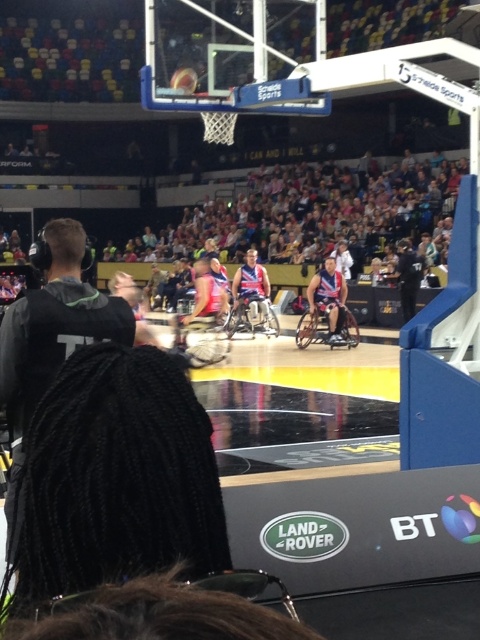
In the scene shown: You are a spectator at the game and want to take a photo of the shiny metallic basketball at center without including the black hoodie at left in the frame. Based on their positions, is this possible?

The black hoodie at left is to the left of the shiny metallic basketball at center, so if you position yourself to the right side of the court and aim towards the center, you can capture the basketball without the hoodie in the frame.

What is the 2D coordinate of the black hoodie at left?

The black hoodie at left is located at the 2D coordinate point of (x=51, y=333).

You are a photographer trying to capture a closeup of the shiny metallic basketball at center. However, there is a black hoodie at left in the way. Based on their sizes, which object should you adjust your camera angle to move around first?

The black hoodie at left is larger in size than the shiny metallic basketball at center, so you should adjust your camera angle to move around the black hoodie at left first as it is bigger and blocking the view.